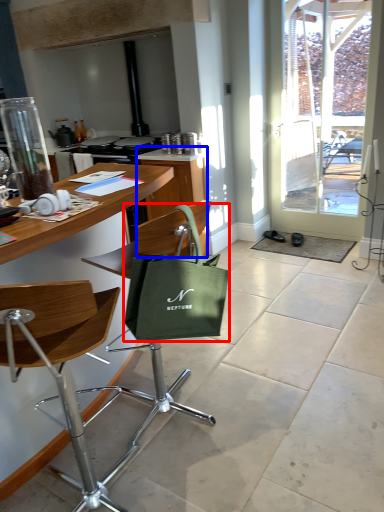
Question: Which point is further to the camera, handbag (highlighted by a red box) or cabinetry (highlighted by a blue box)?

Choices:
 (A) handbag
 (B) cabinetry

Answer: (B)